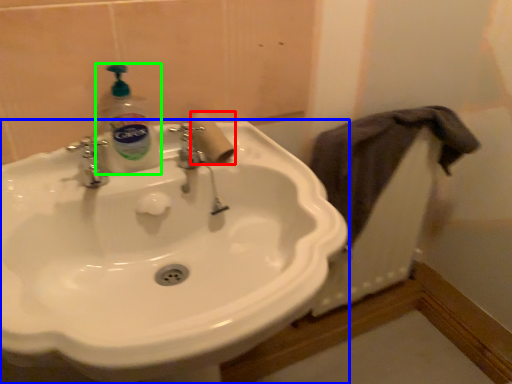
Question: Considering the real-world distances, which object is farthest from toilet paper (highlighted by a red box)? sink (highlighted by a blue box) or cleaning product (highlighted by a green box)?

Choices:
 (A) sink
 (B) cleaning product

Answer: (A)